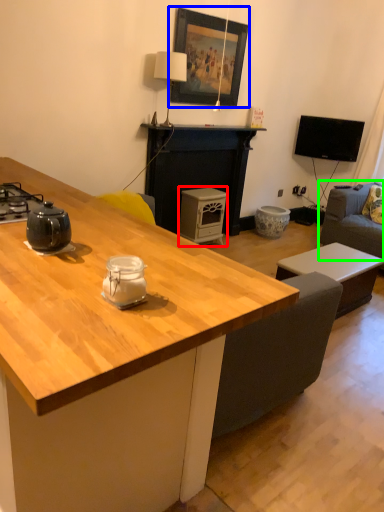
Question: Which object is the closest to the appliance (highlighted by a red box)? Choose among these: picture frame (highlighted by a blue box) or studio couch (highlighted by a green box).

Choices:
 (A) picture frame
 (B) studio couch

Answer: (A)